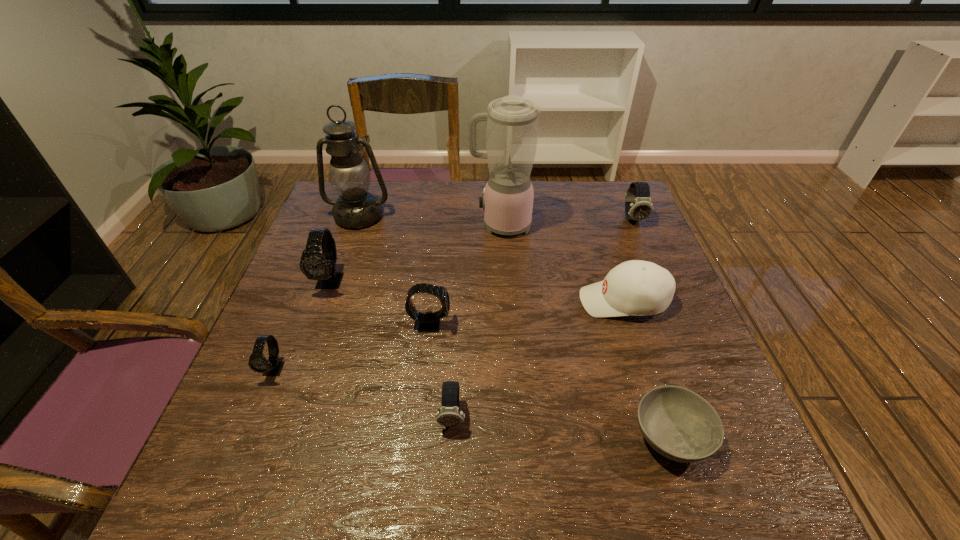
Identify the location of object that is at the near edge. The height and width of the screenshot is (540, 960). (679, 424).

Locate an element on the screen. Image resolution: width=960 pixels, height=540 pixels. oil lamp at the left edge is located at coordinates (355, 208).

This screenshot has width=960, height=540. Identify the location of watch that is at the right edge. (638, 206).

You are a GUI agent. You are given a task and a screenshot of the screen. Output one action in this format:
    pyautogui.click(x=<x>, y=<y>)
    Task: Click on the baseball cap present at the right edge
    This screenshot has width=960, height=540.
    Given the screenshot: What is the action you would take?
    pyautogui.click(x=636, y=287)

Find the location of a particular element. This screenshot has height=540, width=960. bowl positioned at the right edge is located at coordinates (679, 424).

At what (x,y) coordinates should I click in order to perform the action: click on object located at the far left corner. Please return your answer as a coordinate pair (x, y). Looking at the image, I should click on coord(355,208).

Find the location of a particular element. The image size is (960, 540). object positioned at the far right corner is located at coordinates (638, 206).

Where is `object that is at the near right corner`? Image resolution: width=960 pixels, height=540 pixels. object that is at the near right corner is located at coordinates (679, 424).

In the image, there is a desktop. Where is `blank space at the far edge`? The image size is (960, 540). blank space at the far edge is located at coordinates (453, 186).

The image size is (960, 540). Find the location of `vacant space at the near edge`. vacant space at the near edge is located at coordinates (477, 467).